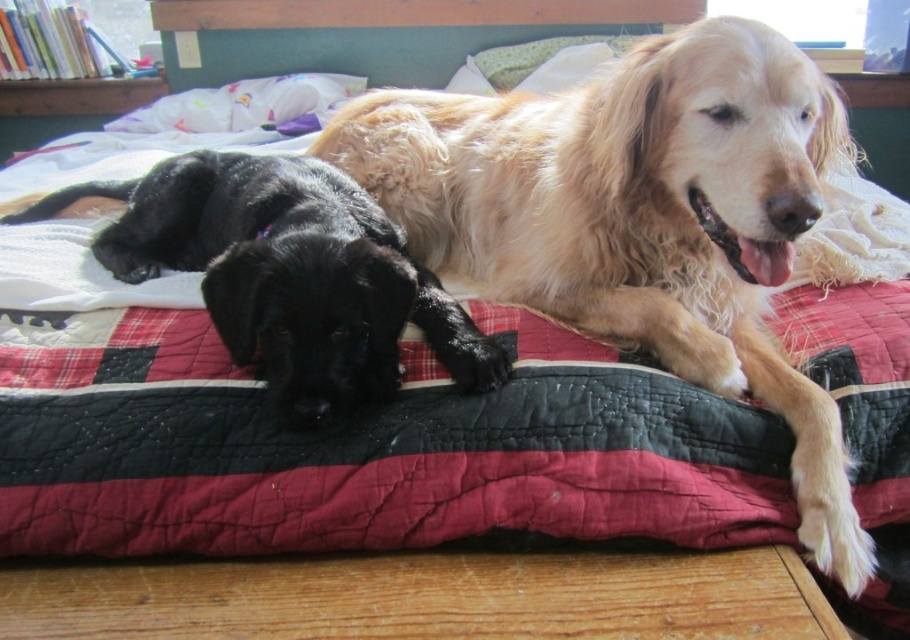
You are a dog owner who wants to place a small toy between the golden fur dog at upper center and the black shiny fur at center on the bed. Considering their sizes, which dog will the toy be closer to after placement?

The golden fur dog at upper center is taller than the black shiny fur at center. Since the toy is placed between them, it will be closer to the black shiny fur at center because the taller dog takes up more space vertically, pushing the toy toward the shorter one.

Looking at this image, you are a photographer taking a picture of the golden fur dog at upper center and the black shiny fur at center. Which dog should you focus on first if you want to capture both in the same frame without moving the camera?

The golden fur dog at upper center should be focused on first because it is located above the black shiny fur at center, so adjusting focus upwards would include both in the frame.